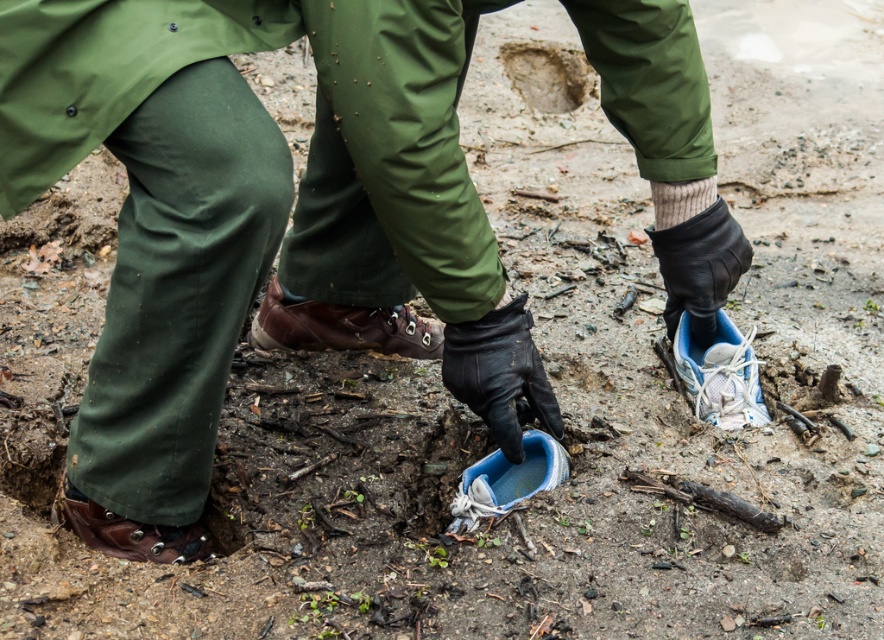
You are a hiker who found a boot stuck in the ground. You have a black leather boot at center and a brown dirt hole at center. Can you fit the boot into the hole without needing to adjust its size?

The black leather boot at center is narrower than the brown dirt hole at center, so it can fit without needing to adjust its size.

You are a hiker who found a white mesh shoe at lower right and a white knitted sock at lower right while digging. Which item is deeper in the ground?

The white mesh shoe at lower right is below the white knitted sock at lower right, so it is deeper in the ground.

Based on the photo, you are a hiker who found your black leather boot at center stuck in the brown dirt hole at center. Can you pull your boot out without making the hole any bigger?

The black leather boot at center occupies less space than brown dirt hole at center, so you can pull your boot out without making the hole any bigger because the boot is smaller than the hole.